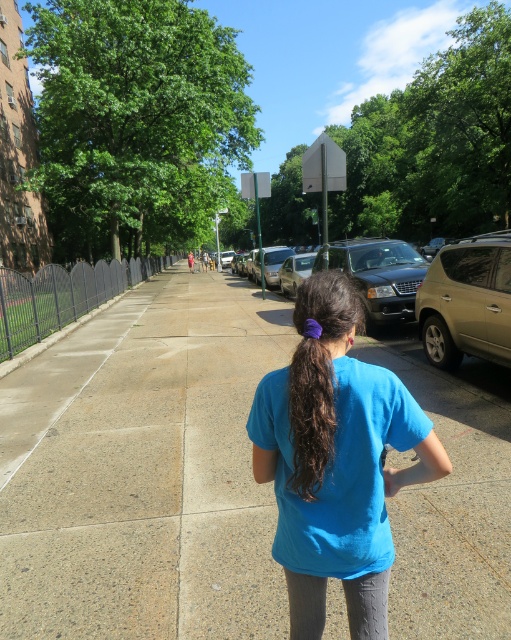
Question: Which of the following is the farthest from the observer?

Choices:
 (A) dark brown curly hair at center
 (B) shiny black sedan at center
 (C) blue cotton shirt at center

Answer: (B)

Question: Can you confirm if gray concrete sidewalk at center is wider than shiny black sedan at center?

Choices:
 (A) no
 (B) yes

Answer: (B)

Question: Where is gray concrete sidewalk at center located in relation to brown silky hair at center in the image?

Choices:
 (A) above
 (B) below

Answer: (B)

Question: Based on their relative distances, which object is farther from the brown silky hair at center?

Choices:
 (A) gray concrete sidewalk at center
 (B) gold metallic suv at right

Answer: (A)

Question: Is gray concrete sidewalk at center positioned before shiny black sedan at center?

Choices:
 (A) yes
 (B) no

Answer: (A)

Question: Estimate the real-world distances between objects in this image. Which object is closer to the gray concrete sidewalk at center?

Choices:
 (A) dark brown curly hair at center
 (B) brown silky hair at center

Answer: (A)